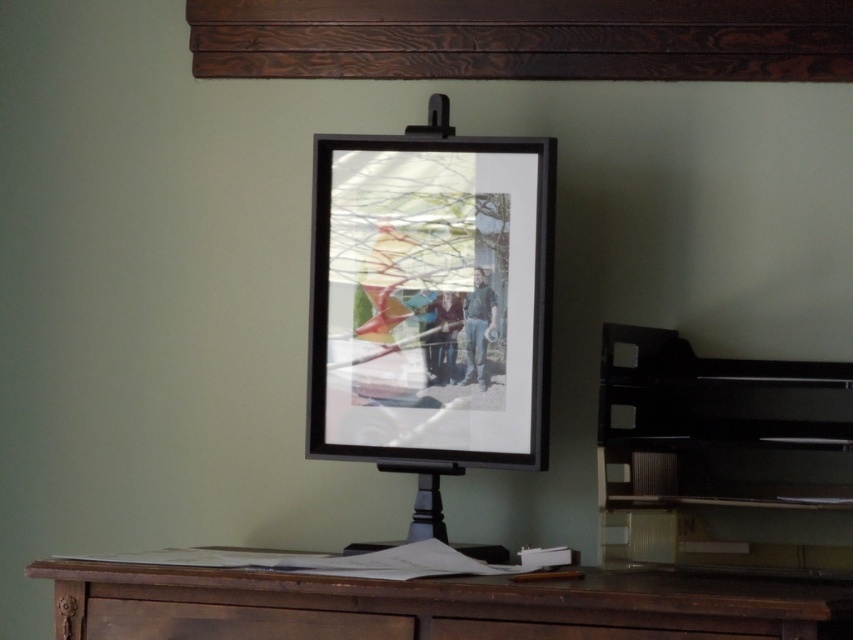
Based on the photo, does black matte easel at center have a greater width compared to brown wood drawer at lower center?

No.

Between black matte easel at center and brown wood drawer at lower center, which one is positioned lower?

Positioned lower is brown wood drawer at lower center.

This screenshot has height=640, width=853. What are the coordinates of `black matte easel at center` in the screenshot? It's located at (722, 458).

The height and width of the screenshot is (640, 853). What are the coordinates of `black matte easel at center` in the screenshot? It's located at (722, 458).

Which is more to the left, black matte picture frame at center or brown wood drawer at lower center?

From the viewer's perspective, brown wood drawer at lower center appears more on the left side.

Which of these two, black matte picture frame at center or brown wood drawer at lower center, stands taller?

black matte picture frame at center

Find the location of a particular element. This screenshot has height=640, width=853. black matte picture frame at center is located at coordinates (430, 300).

Is point (628, 522) positioned after point (483, 588)?

That is True.

Is black matte easel at center thinner than brown wooden table at lower center?

Correct, black matte easel at center's width is less than brown wooden table at lower center's.

Between point (676, 360) and point (761, 580), which one is positioned in front?

Point (761, 580)

At what (x,y) coordinates should I click in order to perform the action: click on black matte easel at center. Please return your answer as a coordinate pair (x, y). Looking at the image, I should click on (722, 458).